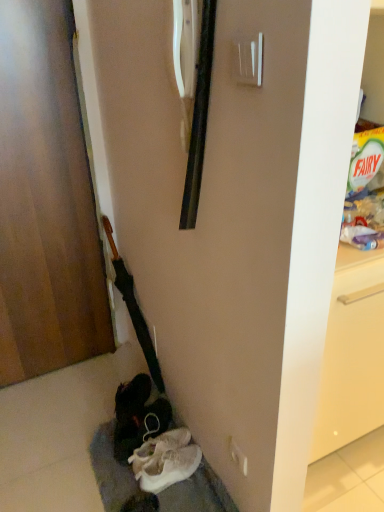
Question: Should I look upward or downward to see white fabric shoe at lower center, positioned as the first footwear in back-to-front order?

Choices:
 (A) down
 (B) up

Answer: (A)

Question: From the image's perspective, is white plastic door handle at upper center beneath white fabric shoe at lower center, which is counted as the second footwear, starting from the front?

Choices:
 (A) yes
 (B) no

Answer: (B)

Question: From the image's perspective, is white plastic door handle at upper center located above white fabric shoe at lower center, positioned as the first footwear in back-to-front order?

Choices:
 (A) yes
 (B) no

Answer: (A)

Question: From a real-world perspective, is white plastic door handle at upper center located beneath white fabric shoe at lower center, which is counted as the second footwear, starting from the front?

Choices:
 (A) yes
 (B) no

Answer: (B)

Question: Does white plastic door handle at upper center have a greater width compared to white fabric shoe at lower center, which is counted as the second footwear, starting from the front?

Choices:
 (A) yes
 (B) no

Answer: (B)

Question: Does white plastic door handle at upper center lie in front of white fabric shoe at lower center, positioned as the first footwear in back-to-front order?

Choices:
 (A) yes
 (B) no

Answer: (A)

Question: Is white plastic door handle at upper center positioned beyond the bounds of white fabric shoe at lower center, positioned as the first footwear in back-to-front order?

Choices:
 (A) yes
 (B) no

Answer: (A)

Question: Does white suede sneakers at lower center, which is counted as the second footwear, starting from the back, have a greater height compared to white fabric shoe at lower center, which is counted as the second footwear, starting from the front?

Choices:
 (A) yes
 (B) no

Answer: (B)

Question: From the image's perspective, is white suede sneakers at lower center, which is counted as the second footwear, starting from the back, beneath white fabric shoe at lower center, which is counted as the second footwear, starting from the front?

Choices:
 (A) yes
 (B) no

Answer: (A)

Question: Can you confirm if white suede sneakers at lower center, the first footwear when ordered from front to back, is thinner than white fabric shoe at lower center, positioned as the first footwear in back-to-front order?

Choices:
 (A) yes
 (B) no

Answer: (A)

Question: Does white suede sneakers at lower center, the first footwear when ordered from front to back, appear on the right side of white fabric shoe at lower center, which is counted as the second footwear, starting from the front?

Choices:
 (A) no
 (B) yes

Answer: (B)

Question: Does white suede sneakers at lower center, which is counted as the second footwear, starting from the back, lie in front of white fabric shoe at lower center, which is counted as the second footwear, starting from the front?

Choices:
 (A) yes
 (B) no

Answer: (A)

Question: From the image's perspective, is white suede sneakers at lower center, the first footwear when ordered from front to back, on white fabric shoe at lower center, positioned as the first footwear in back-to-front order?

Choices:
 (A) no
 (B) yes

Answer: (A)

Question: Can you confirm if wooden door at left is positioned to the right of white plastic door handle at upper center?

Choices:
 (A) no
 (B) yes

Answer: (A)